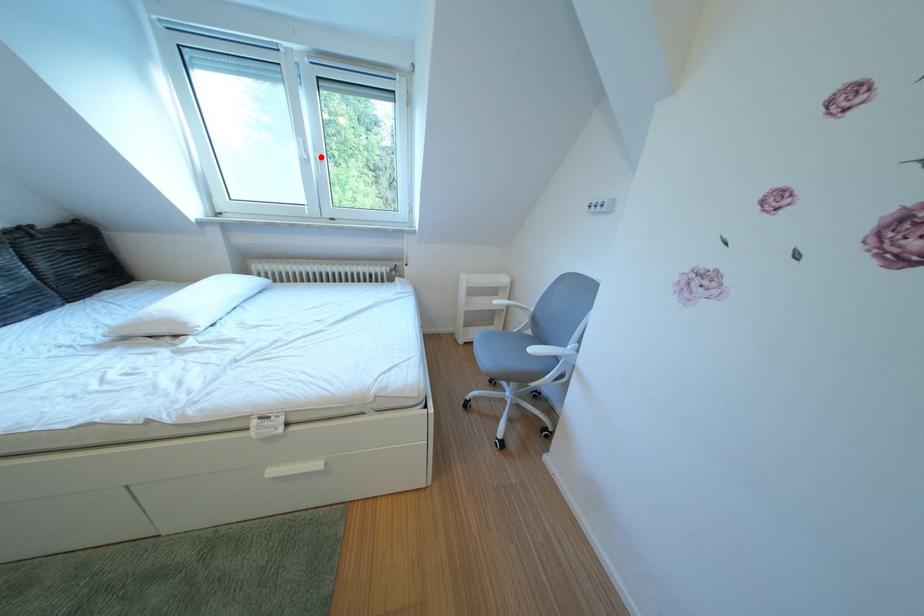
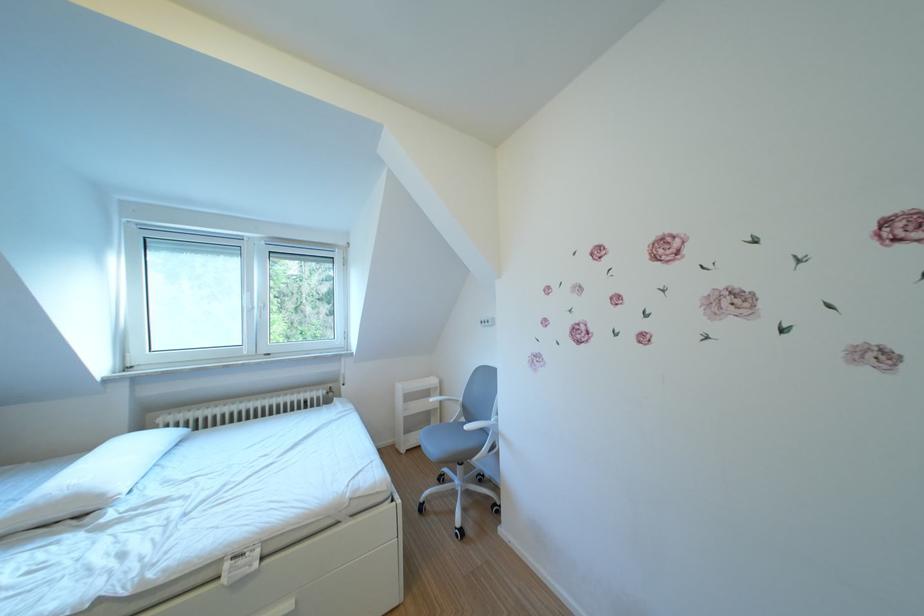
Question: I am providing you with two images of the same scene from different viewpoints. A red point is marked on the first image. At the location where the point appears in image 1, is it still visible in image 2?

Choices:
 (A) Yes
 (B) No

Answer: (A)